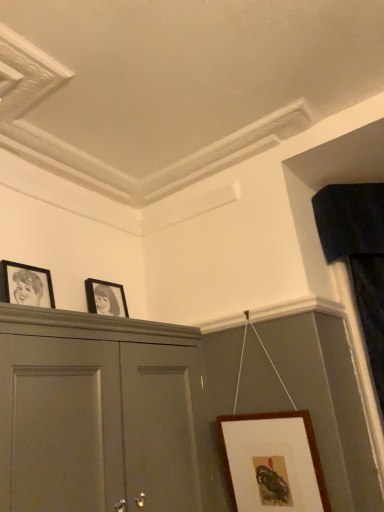
Question: Is velvet dark blue curtain at right aimed at matte gray cabinet at upper left?

Choices:
 (A) yes
 (B) no

Answer: (B)

Question: Is velvet dark blue curtain at right closer to the viewer compared to matte gray cabinet at upper left?

Choices:
 (A) no
 (B) yes

Answer: (A)

Question: Does velvet dark blue curtain at right have a smaller size compared to matte gray cabinet at upper left?

Choices:
 (A) yes
 (B) no

Answer: (A)

Question: From a real-world perspective, is velvet dark blue curtain at right on matte gray cabinet at upper left?

Choices:
 (A) no
 (B) yes

Answer: (B)

Question: Are velvet dark blue curtain at right and matte gray cabinet at upper left located far from each other?

Choices:
 (A) yes
 (B) no

Answer: (A)

Question: From a real-world perspective, is velvet dark blue curtain at right physically below matte gray cabinet at upper left?

Choices:
 (A) no
 (B) yes

Answer: (A)

Question: Can you confirm if matte gray cabinet at upper left is thinner than brown wooden picture frame at lower right, the 3th picture frame viewed from the left?

Choices:
 (A) yes
 (B) no

Answer: (B)

Question: From the image's perspective, is matte gray cabinet at upper left located above brown wooden picture frame at lower right, the third picture frame when ordered from top to bottom?

Choices:
 (A) yes
 (B) no

Answer: (A)

Question: Considering the relative positions of matte gray cabinet at upper left and brown wooden picture frame at lower right, which is the first picture frame in right-to-left order, in the image provided, is matte gray cabinet at upper left to the left of brown wooden picture frame at lower right, which is the first picture frame in right-to-left order, from the viewer's perspective?

Choices:
 (A) no
 (B) yes

Answer: (B)

Question: Considering the relative positions of matte gray cabinet at upper left and brown wooden picture frame at lower right, which is the first picture frame in right-to-left order, in the image provided, is matte gray cabinet at upper left behind brown wooden picture frame at lower right, which is the first picture frame in right-to-left order,?

Choices:
 (A) no
 (B) yes

Answer: (A)

Question: Is matte gray cabinet at upper left in front of brown wooden picture frame at lower right, the 3th picture frame viewed from the left?

Choices:
 (A) yes
 (B) no

Answer: (A)

Question: Considering the relative sizes of matte gray cabinet at upper left and brown wooden picture frame at lower right, which ranks as the 1th picture frame in bottom-to-top order, in the image provided, is matte gray cabinet at upper left taller than brown wooden picture frame at lower right, which ranks as the 1th picture frame in bottom-to-top order,?

Choices:
 (A) no
 (B) yes

Answer: (B)

Question: Would you say matte black picture frame at upper center, placed as the 2th picture frame when sorted from left to right, contains velvet dark blue curtain at right?

Choices:
 (A) no
 (B) yes

Answer: (A)